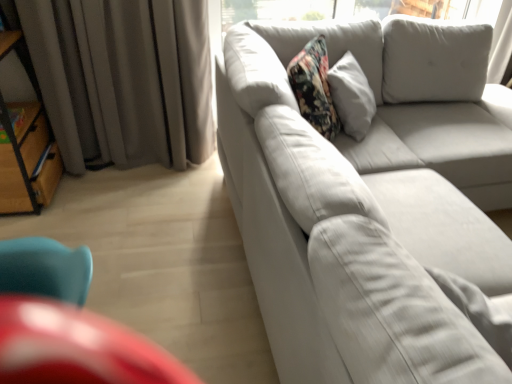
Question: From a real-world perspective, is gray fabric curtain at left located beneath white fabric pillow at center?

Choices:
 (A) yes
 (B) no

Answer: (A)

Question: From a real-world perspective, is gray fabric curtain at left physically above white fabric pillow at center?

Choices:
 (A) no
 (B) yes

Answer: (A)

Question: Is white fabric pillow at center at the back of gray fabric curtain at left?

Choices:
 (A) yes
 (B) no

Answer: (B)

Question: Could white fabric pillow at center be considered to be inside gray fabric curtain at left?

Choices:
 (A) yes
 (B) no

Answer: (B)

Question: Considering the relative sizes of gray fabric curtain at left and white fabric pillow at center in the image provided, is gray fabric curtain at left shorter than white fabric pillow at center?

Choices:
 (A) no
 (B) yes

Answer: (A)

Question: From the image's perspective, is white fabric pillow at center located above or below gray fabric curtain at left?

Choices:
 (A) above
 (B) below

Answer: (B)

Question: Which is correct: white fabric pillow at center is inside gray fabric curtain at left, or outside of it?

Choices:
 (A) inside
 (B) outside

Answer: (B)

Question: From a real-world perspective, is white fabric pillow at center physically located above or below gray fabric curtain at left?

Choices:
 (A) above
 (B) below

Answer: (A)

Question: In terms of width, does white fabric pillow at center look wider or thinner when compared to gray fabric curtain at left?

Choices:
 (A) thin
 (B) wide

Answer: (A)

Question: From their relative heights in the image, would you say white fabric couch at right is taller or shorter than white fabric pillow at center?

Choices:
 (A) short
 (B) tall

Answer: (B)

Question: Would you say white fabric couch at right is inside or outside white fabric pillow at center?

Choices:
 (A) outside
 (B) inside

Answer: (A)

Question: Considering the positions of white fabric couch at right and white fabric pillow at center in the image, is white fabric couch at right bigger or smaller than white fabric pillow at center?

Choices:
 (A) big
 (B) small

Answer: (A)

Question: From a real-world perspective, relative to white fabric pillow at center, is white fabric couch at right vertically above or below?

Choices:
 (A) above
 (B) below

Answer: (B)

Question: Considering their positions, is gray fabric curtain at left located in front of or behind white fabric couch at right?

Choices:
 (A) front
 (B) behind

Answer: (B)

Question: Is gray fabric curtain at left wider or thinner than white fabric couch at right?

Choices:
 (A) wide
 (B) thin

Answer: (B)